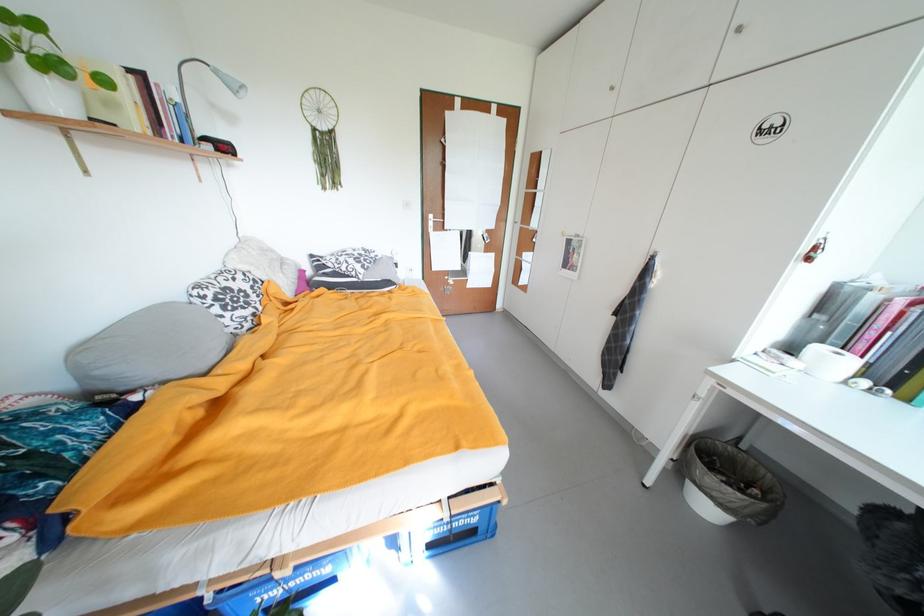
Describe the element at coordinates (432, 222) in the screenshot. The height and width of the screenshot is (616, 924). I see `the silver door handle` at that location.